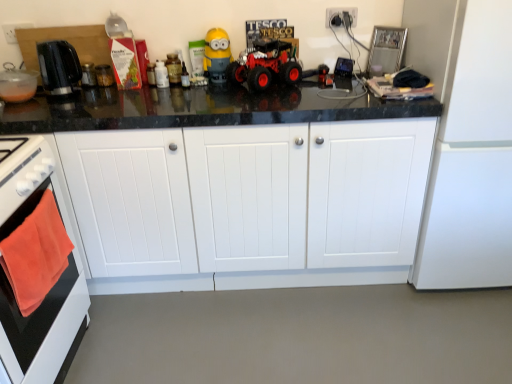
Question: Looking at the image, does yellow matte minion at center seem bigger or smaller compared to rubberized red toy car at center?

Choices:
 (A) small
 (B) big

Answer: (A)

Question: In terms of width, does yellow matte minion at center look wider or thinner when compared to rubberized red toy car at center?

Choices:
 (A) wide
 (B) thin

Answer: (B)

Question: Estimate the real-world distances between objects in this image. Which object is farther from the white wood cabinets at center?

Choices:
 (A) metallic glass jar at upper left, arranged as the second appliance when viewed from the right
 (B) black plastic kettle at left
 (C) yellow matte minion at center
 (D) matte black kettle at left, the first appliance from the left
 (E) white plastic electrical outlet at upper right

Answer: (E)

Question: Which object is the closest to the orange towel at left?

Choices:
 (A) rubberized red toy car at center
 (B) white wood cabinets at center
 (C) black plastic kettle at left
 (D) transparent glass jar at center, which ranks as the 1th appliance in right-to-left order
 (E) white plastic electrical outlet at upper right

Answer: (B)